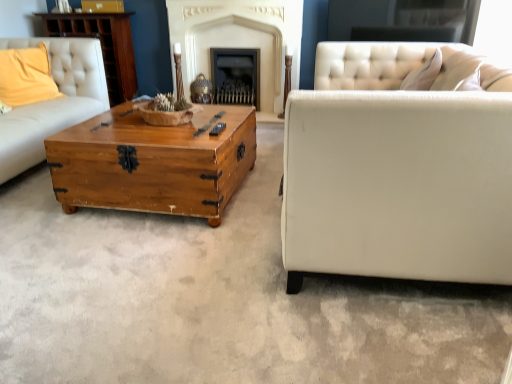
Measure the distance between point [232,76] and camera.

The distance of point [232,76] from camera is 4.14 meters.

What is the approximate width of yellow fabric pillow at upper left?

yellow fabric pillow at upper left is 9.17 inches in width.

What is the approximate height of wooden trunk at center?

The height of wooden trunk at center is 17.08 inches.

Where is `wooden dresser at upper left`? The height and width of the screenshot is (384, 512). wooden dresser at upper left is located at coordinates (102, 46).

From a real-world perspective, is wooden dresser at upper left beneath black matte fireplace at center, the first fireplace in the right-to-left sequence?

Incorrect, from a real-world perspective, wooden dresser at upper left is higher than black matte fireplace at center, the first fireplace in the right-to-left sequence.

Which of these two, wooden dresser at upper left or black matte fireplace at center, the 2th fireplace positioned from the left, stands shorter?

black matte fireplace at center, the 2th fireplace positioned from the left, is shorter.

Considering the relative sizes of wooden dresser at upper left and black matte fireplace at center, the first fireplace in the right-to-left sequence, in the image provided, is wooden dresser at upper left bigger than black matte fireplace at center, the first fireplace in the right-to-left sequence,?

Yes, wooden dresser at upper left is bigger than black matte fireplace at center, the first fireplace in the right-to-left sequence.

Considering the sizes of objects wooden trunk at center and yellow fabric pillow at upper left in the image provided, who is thinner, wooden trunk at center or yellow fabric pillow at upper left?

yellow fabric pillow at upper left is thinner.

Which object is closer to the camera, wooden trunk at center or yellow fabric pillow at upper left?

Positioned in front is wooden trunk at center.

Based on their sizes in the image, would you say wooden trunk at center is bigger or smaller than yellow fabric pillow at upper left?

Considering their sizes, wooden trunk at center takes up more space than yellow fabric pillow at upper left.

Is yellow fabric pillow at upper left next to wooden trunk at center?

No, yellow fabric pillow at upper left is not touching wooden trunk at center.

Considering the relative positions of yellow fabric pillow at upper left and wooden trunk at center in the image provided, is yellow fabric pillow at upper left behind wooden trunk at center?

Yes, it is.

Considering the sizes of objects yellow fabric pillow at upper left and wooden trunk at center in the image provided, who is shorter, yellow fabric pillow at upper left or wooden trunk at center?

wooden trunk at center is shorter.

Is black matte fireplace at center, the first fireplace in the right-to-left sequence, facing towards wooden dresser at upper left?

No, black matte fireplace at center, the first fireplace in the right-to-left sequence, is not oriented towards wooden dresser at upper left.

Considering the sizes of black matte fireplace at center, the 2th fireplace positioned from the left, and wooden dresser at upper left in the image, is black matte fireplace at center, the 2th fireplace positioned from the left, bigger or smaller than wooden dresser at upper left?

black matte fireplace at center, the 2th fireplace positioned from the left, is smaller than wooden dresser at upper left.

Can you tell me how much black matte fireplace at center, the 2th fireplace positioned from the left, and wooden dresser at upper left differ in facing direction?

black matte fireplace at center, the 2th fireplace positioned from the left, and wooden dresser at upper left are facing 1.1 degrees away from each other.

Is point (221, 66) more distant than point (95, 26)?

Yes, point (221, 66) is farther from viewer.

Considering the positions of objects wooden trunk at center and wooden dresser at upper left in the image provided, who is more to the left, wooden trunk at center or wooden dresser at upper left?

wooden dresser at upper left is more to the left.

Does wooden trunk at center come behind wooden dresser at upper left?

No, the depth of wooden trunk at center is less than that of wooden dresser at upper left.

Is wooden trunk at center turned away from wooden dresser at upper left?

No, wooden dresser at upper left is not at the back of wooden trunk at center.

Between wooden trunk at center and wooden dresser at upper left, which one has larger size?

Bigger between the two is wooden trunk at center.

Does wooden dresser at upper left have a smaller size compared to smooth stone fireplace at center, the 2th fireplace when ordered from right to left?

Actually, wooden dresser at upper left might be larger than smooth stone fireplace at center, the 2th fireplace when ordered from right to left.

From a real-world perspective, is wooden dresser at upper left above or below smooth stone fireplace at center, the 2th fireplace when ordered from right to left?

From a real-world perspective, wooden dresser at upper left is physically below smooth stone fireplace at center, the 2th fireplace when ordered from right to left.

From the image's perspective, is wooden dresser at upper left on smooth stone fireplace at center, the 1th fireplace from the left?

No, from the image's perspective, wooden dresser at upper left is not on top of smooth stone fireplace at center, the 1th fireplace from the left.

Is wooden dresser at upper left oriented away from smooth stone fireplace at center, the 2th fireplace when ordered from right to left?

wooden dresser at upper left does not have its back to smooth stone fireplace at center, the 2th fireplace when ordered from right to left.

How much distance is there between smooth stone fireplace at center, the 2th fireplace when ordered from right to left, and wooden trunk at center?

They are 5.74 feet apart.

Is smooth stone fireplace at center, the 1th fireplace from the left, positioned behind wooden trunk at center?

Yes, smooth stone fireplace at center, the 1th fireplace from the left, is further from the camera.

I want to click on coffee table lying on the left of smooth stone fireplace at center, the 2th fireplace when ordered from right to left, so click(x=153, y=162).

I want to click on fireplace behind the wooden dresser at upper left, so click(236, 76).

The image size is (512, 384). I want to click on coffee table beneath the yellow fabric pillow at upper left (from a real-world perspective), so click(153, 162).

From the picture: Estimate the real-world distances between objects in this image. Which object is further from wooden dresser at upper left, yellow fabric pillow at upper left or wooden trunk at center?

wooden trunk at center.

When comparing their distances from yellow fabric pillow at upper left, does black matte fireplace at center, the 2th fireplace positioned from the left, or smooth stone fireplace at center, the 1th fireplace from the left, seem closer?

smooth stone fireplace at center, the 1th fireplace from the left, is positioned closer to the anchor yellow fabric pillow at upper left.

Based on their spatial positions, is yellow fabric pillow at upper left or wooden dresser at upper left closer to smooth stone fireplace at center, the 1th fireplace from the left?

Based on the image, wooden dresser at upper left appears to be nearer to smooth stone fireplace at center, the 1th fireplace from the left.

Looking at the image, which one is located closer to wooden dresser at upper left, black matte fireplace at center, the 2th fireplace positioned from the left, or wooden trunk at center?

black matte fireplace at center, the 2th fireplace positioned from the left, lies closer to wooden dresser at upper left than the other object.

Estimate the real-world distances between objects in this image. Which object is closer to black matte fireplace at center, the 2th fireplace positioned from the left, yellow fabric pillow at upper left or wooden trunk at center?

The object closer to black matte fireplace at center, the 2th fireplace positioned from the left, is yellow fabric pillow at upper left.

Estimate the real-world distances between objects in this image. Which object is closer to yellow fabric pillow at upper left, smooth stone fireplace at center, the 1th fireplace from the left, or wooden trunk at center?

The object closer to yellow fabric pillow at upper left is wooden trunk at center.

Based on their spatial positions, is black matte fireplace at center, the 2th fireplace positioned from the left, or wooden dresser at upper left further from yellow fabric pillow at upper left?

black matte fireplace at center, the 2th fireplace positioned from the left, is further to yellow fabric pillow at upper left.

Estimate the real-world distances between objects in this image. Which object is closer to wooden trunk at center, black matte fireplace at center, the 2th fireplace positioned from the left, or yellow fabric pillow at upper left?

yellow fabric pillow at upper left lies closer to wooden trunk at center than the other object.

The height and width of the screenshot is (384, 512). In order to click on fireplace located between wooden dresser at upper left and black matte fireplace at center, the first fireplace in the right-to-left sequence, in the left-right direction in this screenshot , I will do `click(238, 39)`.

Locate an element on the screen. This screenshot has height=384, width=512. pillow between wooden trunk at center and smooth stone fireplace at center, the 2th fireplace when ordered from right to left, along the z-axis is located at coordinates (26, 76).

Identify the location of fireplace between wooden trunk at center and black matte fireplace at center, the 2th fireplace positioned from the left, along the z-axis. (238, 39).

At what (x,y) coordinates should I click in order to perform the action: click on dresser located between yellow fabric pillow at upper left and smooth stone fireplace at center, the 2th fireplace when ordered from right to left, in the left-right direction. Please return your answer as a coordinate pair (x, y). The image size is (512, 384). Looking at the image, I should click on (102, 46).